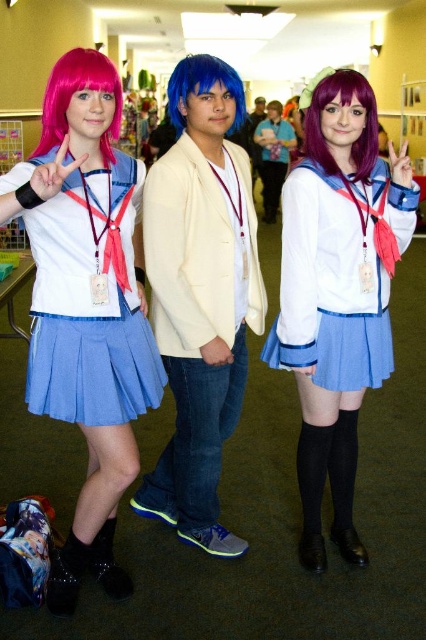
Based on the photo, is white matte blazer at center taller than matte blue pleated skirt at left?

Correct, white matte blazer at center is much taller as matte blue pleated skirt at left.

Based on the photo, can you confirm if white matte blazer at center is positioned above matte blue pleated skirt at left?

Actually, white matte blazer at center is below matte blue pleated skirt at left.

Which is behind, point (252, 240) or point (123, 417)?

Positioned behind is point (252, 240).

Where is `white matte blazer at center`? white matte blazer at center is located at coordinates (198, 316).

Can you confirm if satin pink wig at left is positioned to the right of pink synthetic wig at upper left?

Correct, you'll find satin pink wig at left to the right of pink synthetic wig at upper left.

Between satin pink wig at left and pink synthetic wig at upper left, which one appears on the right side from the viewer's perspective?

satin pink wig at left

Is point (91, 195) closer to viewer compared to point (94, 77)?

No, it is behind (94, 77).

The image size is (426, 640). I want to click on satin pink wig at left, so click(86, 304).

How much distance is there between purple silky wig at center and metallic silver badge at center?

They are 3.41 feet apart.

Can you confirm if purple silky wig at center is positioned below metallic silver badge at center?

Incorrect, purple silky wig at center is not positioned below metallic silver badge at center.

This screenshot has height=640, width=426. Describe the element at coordinates (342, 104) in the screenshot. I see `purple silky wig at center` at that location.

Identify the location of purple silky wig at center. The image size is (426, 640). (342, 104).